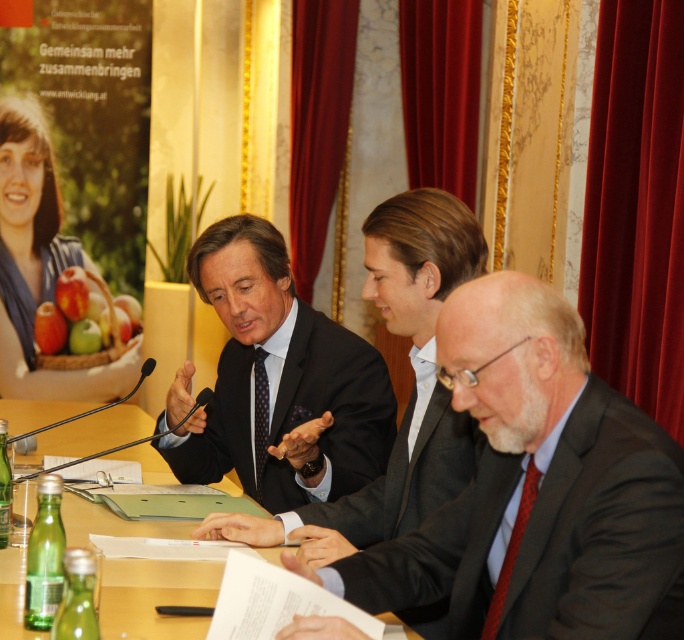
You are a photographer setting up for a group photo. You need to ensure that the dark blue textured suit at center and the wooden table at center are both visible in the frame. Based on their positions, which object should you focus on first to ensure both are in focus?

The dark blue textured suit at center is above the wooden table at center, so you should focus on the wooden table at center first to ensure both are in focus since it is closer to the camera.

You are standing in front of the table where the three men are seated. You need to place a small plant between the two points marked as point (44, 436) and point (449, 456). Which point should the plant be closer to so it appears closer to you?

The plant should be placed closer to point (44, 436) because it is further to the viewer than point (449, 456).

You are an event planner trying to arrange a photo shoot for the event. You need to position a camera to capture both the black matte suit at lower right and the dark blue textured suit at center clearly. Which suit should you focus on first to ensure both are in focus?

The black matte suit at lower right is closer to the viewer than the dark blue textured suit at center. To ensure both are in focus, focus on the black matte suit at lower right first, as it is closer, and the depth of field will likely cover the dark blue textured suit at center which is further away.